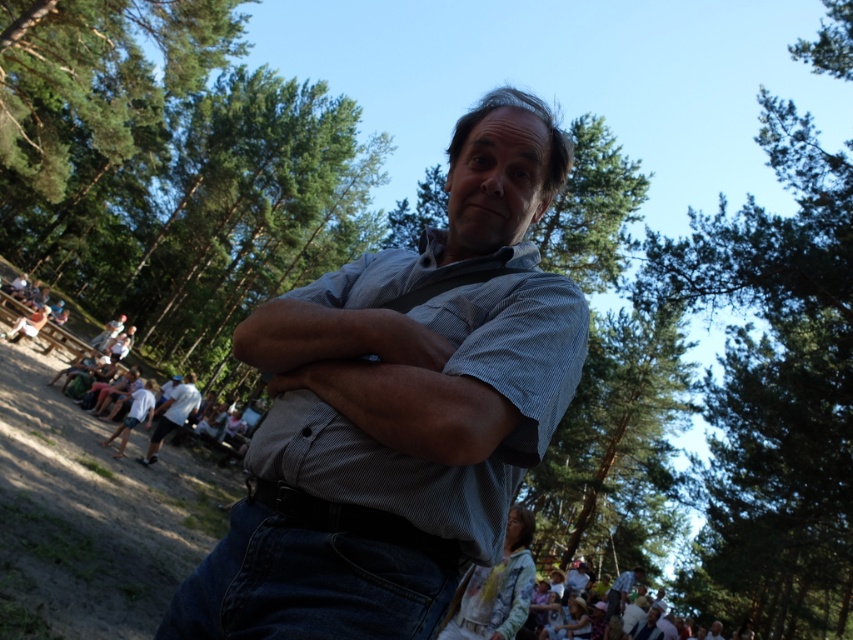
Is white cotton shirt at lower left closer to the viewer compared to blue striped shirt at center?

Yes, white cotton shirt at lower left is in front of blue striped shirt at center.

Is point (194, 372) less distant than point (624, 600)?

No.

Is point (186, 372) closer to viewer compared to point (612, 593)?

No, (186, 372) is further to viewer.

Identify the location of white cotton shirt at lower left. The image size is (853, 640). click(172, 413).

Who is taller, striped cotton shirt at center or blue striped shirt at center?

striped cotton shirt at center is taller.

Which is more to the left, striped cotton shirt at center or blue striped shirt at center?

striped cotton shirt at center is more to the left.

Is point (325, 392) in front of point (630, 577)?

Yes, it is.

Where is `striped cotton shirt at center`? The image size is (853, 640). striped cotton shirt at center is located at coordinates (399, 410).

Does striped cotton shirt at center have a greater width compared to white cotton shirt at lower left?

Indeed, striped cotton shirt at center has a greater width compared to white cotton shirt at lower left.

Does striped cotton shirt at center appear under white cotton shirt at lower left?

Actually, striped cotton shirt at center is above white cotton shirt at lower left.

Is point (410, 266) positioned before point (178, 410)?

Yes, point (410, 266) is in front of point (178, 410).

Where is `striped cotton shirt at center`? The width and height of the screenshot is (853, 640). striped cotton shirt at center is located at coordinates (399, 410).